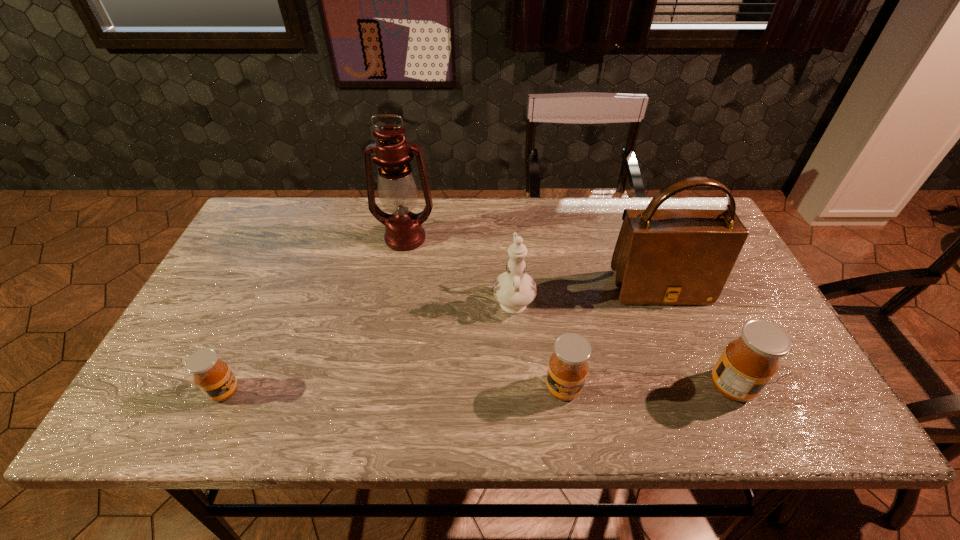
You are a GUI agent. You are given a task and a screenshot of the screen. Output one action in this format:
    pyautogui.click(x=<x>, y=<y>)
    Task: Click on the honey that is the closest one to the oil lamp
    This screenshot has width=960, height=540.
    Given the screenshot: What is the action you would take?
    pyautogui.click(x=214, y=378)

Identify the location of free space that satisfies the following two spatial constraints: 1. on the front-facing side of the second shortest honey; 2. on the front-facing side of the shortest honey. (564, 392).

The image size is (960, 540). I want to click on free space that satisfies the following two spatial constraints: 1. on the front-facing side of the second shortest object; 2. on the front-facing side of the leftmost honey, so click(564, 392).

Where is `free space that satisfies the following two spatial constraints: 1. on the front-facing side of the second honey from left to right; 2. on the front-facing side of the leftmost object`? This screenshot has width=960, height=540. free space that satisfies the following two spatial constraints: 1. on the front-facing side of the second honey from left to right; 2. on the front-facing side of the leftmost object is located at coordinates (564, 392).

Locate an element on the screen. vacant area that satisfies the following two spatial constraints: 1. on the front flap of the shoulder bag; 2. on the front-facing side of the shortest honey is located at coordinates (700, 392).